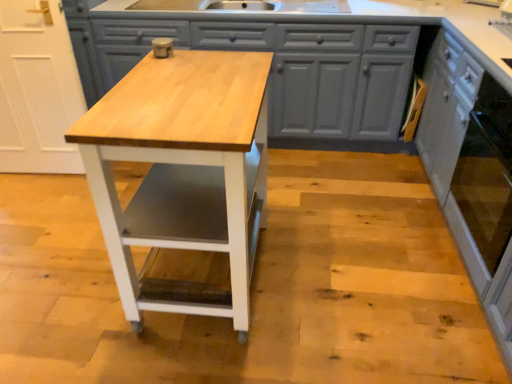
Question: Can you confirm if matte gray cabinets at center, placed as the first cabinetry when sorted from left to right, is thinner than white painted wood cabinet at right, marked as the second cabinetry in a left-to-right arrangement?

Choices:
 (A) no
 (B) yes

Answer: (A)

Question: Is matte gray cabinets at center, placed as the first cabinetry when sorted from left to right, positioned with its back to white painted wood cabinet at right, arranged as the 1th cabinetry when viewed from the right?

Choices:
 (A) no
 (B) yes

Answer: (A)

Question: From a real-world perspective, does matte gray cabinets at center, placed as the first cabinetry when sorted from left to right, stand above white painted wood cabinet at right, arranged as the 1th cabinetry when viewed from the right?

Choices:
 (A) no
 (B) yes

Answer: (A)

Question: Is matte gray cabinets at center, placed as the first cabinetry when sorted from left to right, next to white painted wood cabinet at right, marked as the second cabinetry in a left-to-right arrangement?

Choices:
 (A) no
 (B) yes

Answer: (A)

Question: Is matte gray cabinets at center, placed as the first cabinetry when sorted from left to right, to the right of white painted wood cabinet at right, arranged as the 1th cabinetry when viewed from the right, from the viewer's perspective?

Choices:
 (A) yes
 (B) no

Answer: (B)

Question: In the image, is natural wood table at center positioned in front of or behind matte gray cabinets at center, placed as the first cabinetry when sorted from left to right?

Choices:
 (A) front
 (B) behind

Answer: (A)

Question: Does point (155, 109) appear closer or farther from the camera than point (407, 36)?

Choices:
 (A) closer
 (B) farther

Answer: (A)

Question: Is natural wood table at center to the left or to the right of matte gray cabinets at center, placed as the first cabinetry when sorted from left to right, in the image?

Choices:
 (A) left
 (B) right

Answer: (A)

Question: From the image's perspective, is natural wood table at center located above or below matte gray cabinets at center, which is the second cabinetry from right to left?

Choices:
 (A) above
 (B) below

Answer: (B)

Question: Considering the relative positions of white painted wood cabinet at right, marked as the second cabinetry in a left-to-right arrangement, and natural wood table at center in the image provided, is white painted wood cabinet at right, marked as the second cabinetry in a left-to-right arrangement, to the left or to the right of natural wood table at center?

Choices:
 (A) right
 (B) left

Answer: (A)

Question: Is white painted wood cabinet at right, marked as the second cabinetry in a left-to-right arrangement, spatially inside natural wood table at center, or outside of it?

Choices:
 (A) inside
 (B) outside

Answer: (B)

Question: Is white painted wood cabinet at right, marked as the second cabinetry in a left-to-right arrangement, in front of or behind natural wood table at center in the image?

Choices:
 (A) behind
 (B) front

Answer: (B)

Question: Considering the positions of white painted wood cabinet at right, marked as the second cabinetry in a left-to-right arrangement, and natural wood table at center in the image, is white painted wood cabinet at right, marked as the second cabinetry in a left-to-right arrangement, wider or thinner than natural wood table at center?

Choices:
 (A) wide
 (B) thin

Answer: (B)

Question: Based on their sizes in the image, would you say white painted wood cabinet at right, arranged as the 1th cabinetry when viewed from the right, is bigger or smaller than matte gray cabinets at center, which is the second cabinetry from right to left?

Choices:
 (A) small
 (B) big

Answer: (A)

Question: Does point (466, 264) appear closer or farther from the camera than point (150, 28)?

Choices:
 (A) closer
 (B) farther

Answer: (A)